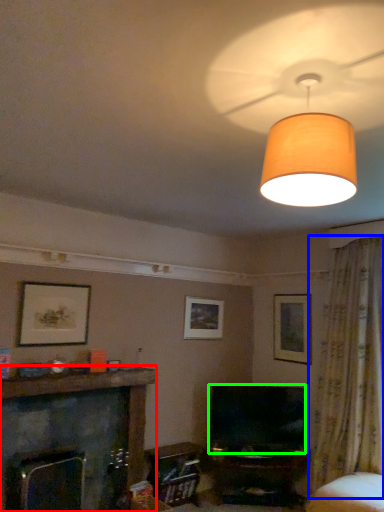
Question: Based on their relative distances, which object is farther from fireplace (highlighted by a red box)? Choose from curtain (highlighted by a blue box) and television (highlighted by a green box).

Choices:
 (A) curtain
 (B) television

Answer: (A)